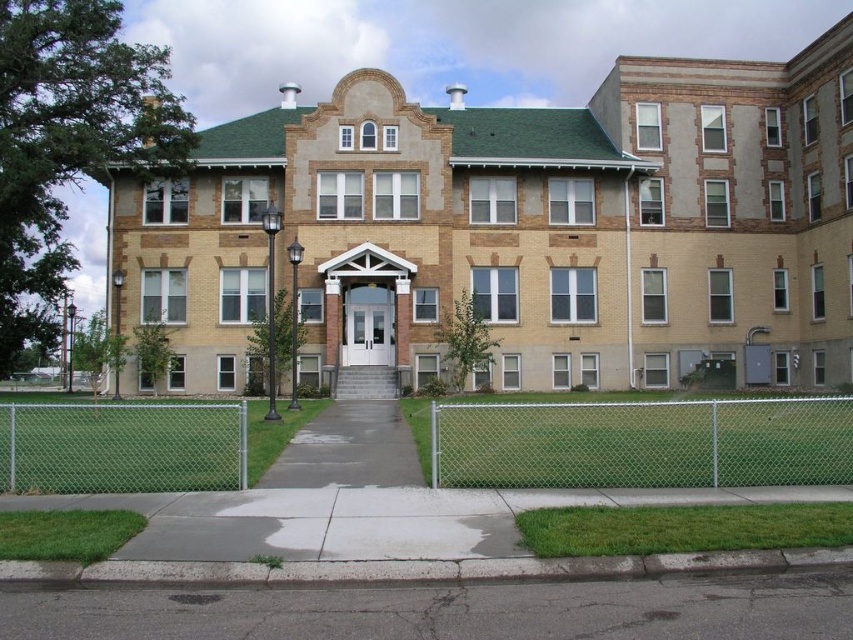
Question: Among these objects, which one is farthest from the camera?

Choices:
 (A) gray asphalt at lower center
 (B) gray concrete sidewalk at center
 (C) silver chain-link fence at lower right

Answer: (B)

Question: Among these objects, which one is nearest to the camera?

Choices:
 (A) silver chain-link fence at lower right
 (B) gray concrete sidewalk at center
 (C) gray asphalt at lower center
 (D) green chain-link fence at lower left

Answer: (C)

Question: Which of the following is the closest to the observer?

Choices:
 (A) (386, 429)
 (B) (462, 604)

Answer: (B)

Question: Can you confirm if silver chain-link fence at lower right is positioned to the right of gray concrete sidewalk at center?

Choices:
 (A) yes
 (B) no

Answer: (A)

Question: Is silver chain-link fence at lower right wider than green chain-link fence at lower left?

Choices:
 (A) no
 (B) yes

Answer: (B)

Question: Is silver chain-link fence at lower right bigger than gray concrete sidewalk at center?

Choices:
 (A) yes
 (B) no

Answer: (A)